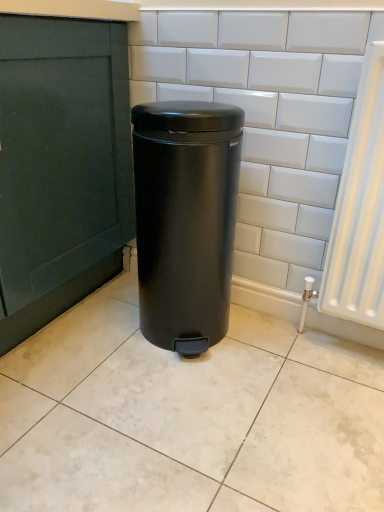
Question: Is the position of white glossy ceramic tile at center less distant than that of matte black trash can at center?

Choices:
 (A) no
 (B) yes

Answer: (B)

Question: Can you confirm if white glossy ceramic tile at center is positioned to the left of matte black trash can at center?

Choices:
 (A) yes
 (B) no

Answer: (A)

Question: Is white glossy ceramic tile at center facing away from matte black trash can at center?

Choices:
 (A) no
 (B) yes

Answer: (A)

Question: From a real-world perspective, is white glossy ceramic tile at center on top of matte black trash can at center?

Choices:
 (A) yes
 (B) no

Answer: (B)

Question: Considering the relative sizes of white glossy ceramic tile at center and matte black trash can at center in the image provided, is white glossy ceramic tile at center shorter than matte black trash can at center?

Choices:
 (A) no
 (B) yes

Answer: (B)

Question: Is white glossy ceramic tile at center wider than matte black trash can at center?

Choices:
 (A) yes
 (B) no

Answer: (A)

Question: Can you confirm if matte black trash can at center is bigger than white glossy ceramic tile at center?

Choices:
 (A) no
 (B) yes

Answer: (B)

Question: Is matte black trash can at center facing away from white glossy ceramic tile at center?

Choices:
 (A) no
 (B) yes

Answer: (A)

Question: From the image's perspective, would you say matte black trash can at center is positioned over white glossy ceramic tile at center?

Choices:
 (A) yes
 (B) no

Answer: (A)

Question: Is matte black trash can at center positioned before white glossy ceramic tile at center?

Choices:
 (A) no
 (B) yes

Answer: (A)

Question: Is matte black trash can at center at the left side of white glossy ceramic tile at center?

Choices:
 (A) no
 (B) yes

Answer: (A)

Question: Can you confirm if matte black trash can at center is smaller than white glossy ceramic tile at center?

Choices:
 (A) no
 (B) yes

Answer: (A)

Question: Considering their positions, is matte black trash can at center located in front of or behind white glossy ceramic tile at center?

Choices:
 (A) front
 (B) behind

Answer: (B)